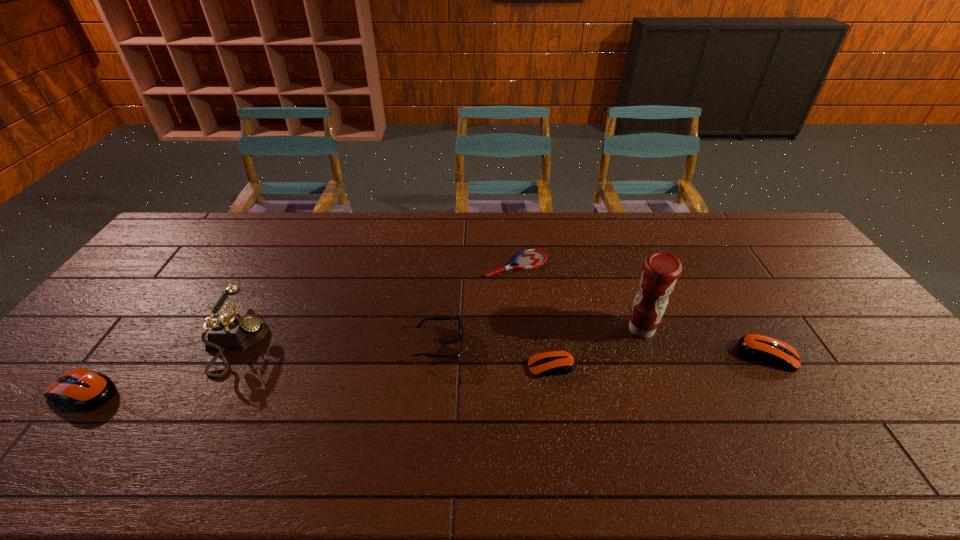
To achieve even spacing by inserting another mouse_(computer_equipment) among them, please point to a vacant spot for this new mouse_(computer_equipment). Please provide its 2D coordinates. Your answer should be formatted as a tuple, i.e. [(x, y)], where the tuple contains the x and y coordinates of a point satisfying the conditions above.

[(324, 379)]